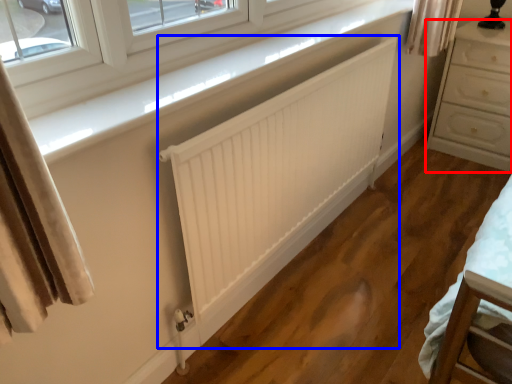
Question: Which point is further to the camera, chest of drawers (highlighted by a red box) or radiator (highlighted by a blue box)?

Choices:
 (A) chest of drawers
 (B) radiator

Answer: (A)